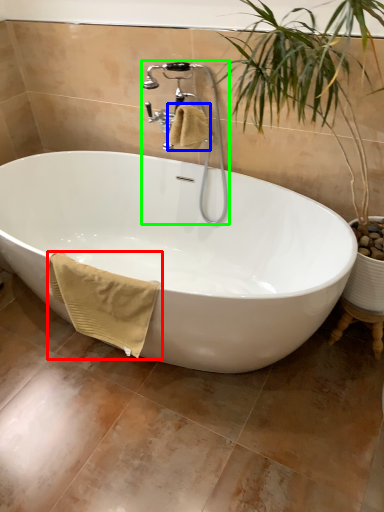
Question: Which object is positioned farthest from bath towel (highlighted by a red box)? Select from bath towel (highlighted by a blue box) and faucet (highlighted by a green box).

Choices:
 (A) bath towel
 (B) faucet

Answer: (B)